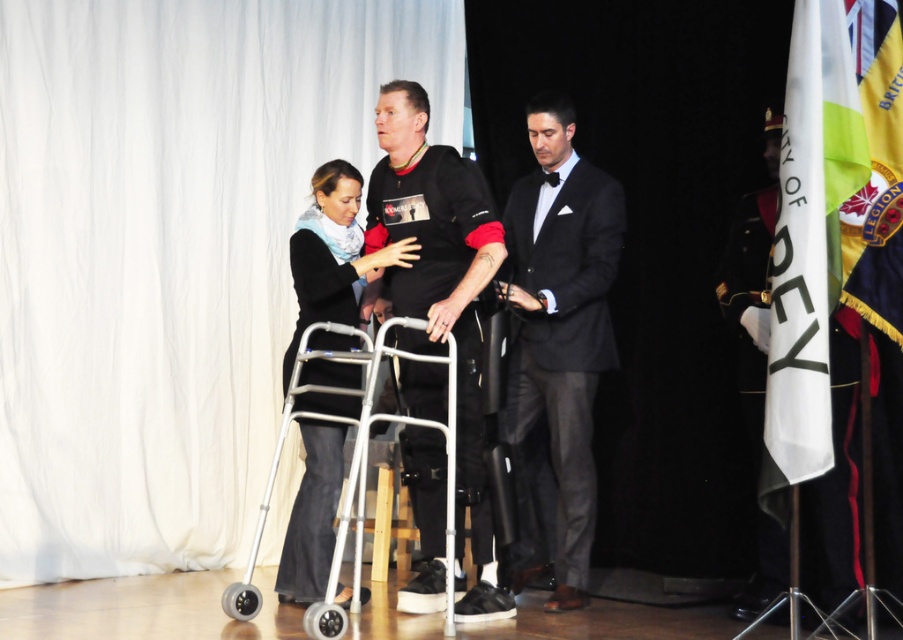
You are an event organizer and need to hang a new banner behind the stage. The banner requires a space that is closer to the audience than both the white matte curtain at upper left and the white fabric flag at right. Is there a suitable location available based on the scene?

The white matte curtain at upper left is closer to the audience than the white fabric flag at right. Since the banner needs to be placed closer than both, there is no suitable location available as the curtain is already the closest object to the audience.

You are an event planner trying to set up a camera for the live stream. You need to position it so that it captures the entire stage without any obstruction from the white matte curtain at upper left. Where should you place the camera relative to the point where the curtain starts at point (169,253)?

The white matte curtain at upper left starts at point (169,253). To avoid obstruction, position the camera below this point to ensure the curtain does not block the view of the stage.

You are a stagehand preparing for a formal event. You need to hang a large banner that requires a support structure. Based on the scene, which object between the white matte curtain at upper left and the white fabric flag at right would be more suitable for attaching the banner? Explain your choice using their sizes.

The white matte curtain at upper left has a larger size compared to the white fabric flag at right, making it more suitable for attaching the large banner as it can provide sufficient support and space.